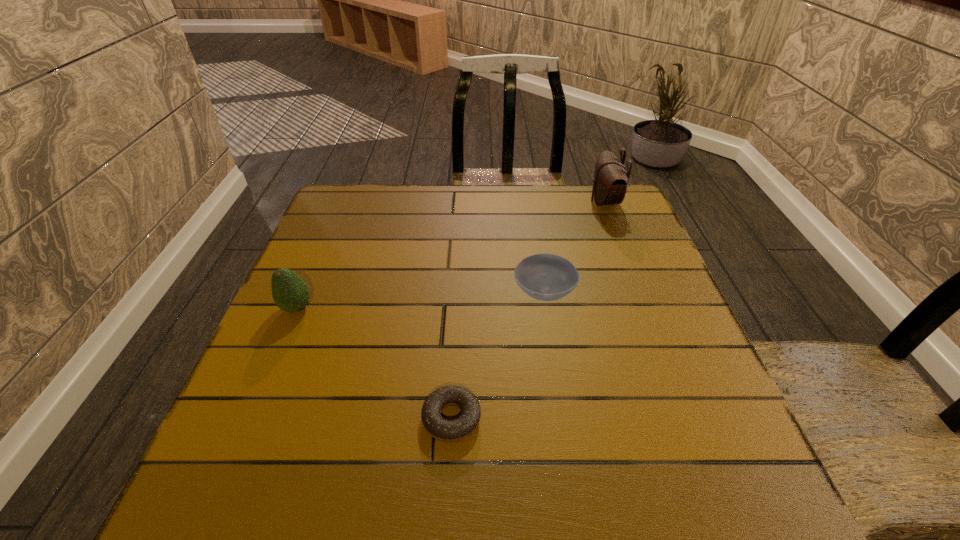
You are a GUI agent. You are given a task and a screenshot of the screen. Output one action in this format:
    pyautogui.click(x=<x>, y=<y>)
    Task: Click on the rightmost object
    
    Given the screenshot: What is the action you would take?
    pyautogui.click(x=611, y=178)

At what (x,y) coordinates should I click in order to perform the action: click on the farthest object. Please return your answer as a coordinate pair (x, y). The width and height of the screenshot is (960, 540). Looking at the image, I should click on pyautogui.click(x=611, y=178).

The width and height of the screenshot is (960, 540). I want to click on the third shortest object, so click(x=290, y=292).

Find the location of a particular element. The image size is (960, 540). the leftmost object is located at coordinates (290, 292).

The image size is (960, 540). Identify the location of bowl. (546, 277).

At what (x,y) coordinates should I click in order to perform the action: click on the third object from left to right. Please return your answer as a coordinate pair (x, y). This screenshot has height=540, width=960. Looking at the image, I should click on (546, 277).

Locate an element on the screen. Image resolution: width=960 pixels, height=540 pixels. the nearest object is located at coordinates (439, 428).

This screenshot has height=540, width=960. Identify the location of the shortest object. point(439,428).

Where is `vacant area situated 0.370m with the flap open on the farthest object`? The image size is (960, 540). vacant area situated 0.370m with the flap open on the farthest object is located at coordinates (464, 201).

You are a GUI agent. You are given a task and a screenshot of the screen. Output one action in this format:
    pyautogui.click(x=<x>, y=<y>)
    Task: Click on the free space located with the flap open on the farthest object
    
    Given the screenshot: What is the action you would take?
    [549, 201]